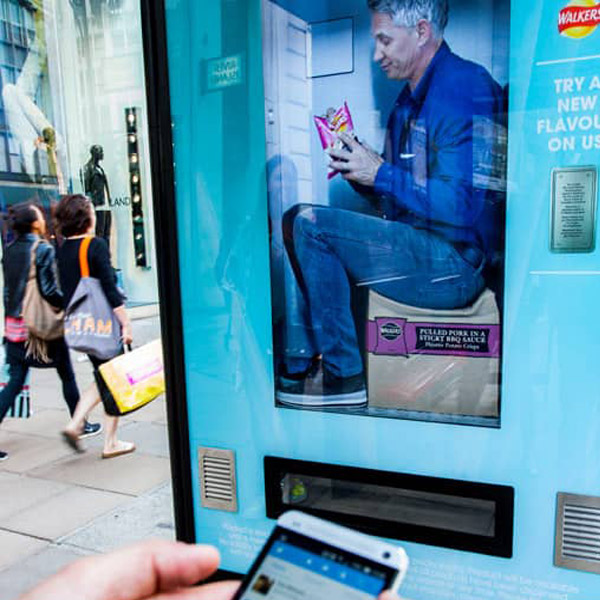
Where is `phone`? phone is located at coordinates (330, 546).